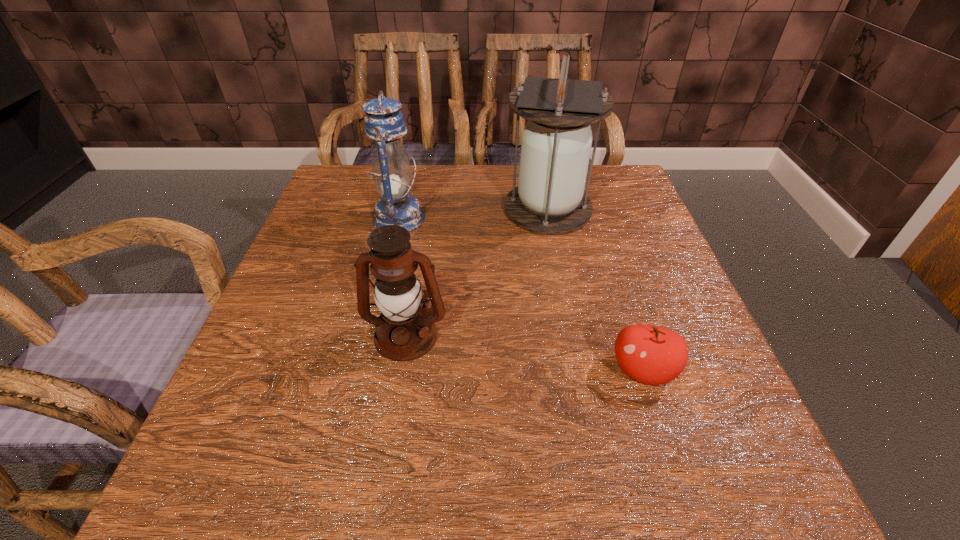
This screenshot has height=540, width=960. Identify the location of object situated at the far right corner. (556, 142).

The width and height of the screenshot is (960, 540). I want to click on vacant space at the far edge of the desktop, so click(500, 191).

Find the location of a particular element. The image size is (960, 540). free region at the left edge of the desktop is located at coordinates (348, 279).

Where is `blank space at the right edge`? This screenshot has height=540, width=960. blank space at the right edge is located at coordinates (616, 228).

In the image, there is a desktop. Where is `vacant space at the far left corner`? vacant space at the far left corner is located at coordinates (325, 210).

The width and height of the screenshot is (960, 540). In order to click on free spot at the far right corner of the desktop in this screenshot , I will do `click(595, 165)`.

Find the location of a particular element. vacant area at the near right corner of the desktop is located at coordinates (694, 482).

You are a GUI agent. You are given a task and a screenshot of the screen. Output one action in this format:
    pyautogui.click(x=<x>, y=<y>)
    Task: Click on the empty space between the nearest lantern and the shortest object
    The image size is (960, 540).
    Given the screenshot: What is the action you would take?
    pyautogui.click(x=524, y=353)

Where is `free point between the nearest lantern and the shortest object`? The width and height of the screenshot is (960, 540). free point between the nearest lantern and the shortest object is located at coordinates (524, 353).

This screenshot has height=540, width=960. Identify the location of vacant area that lies between the shortest object and the nearest lantern. (524, 353).